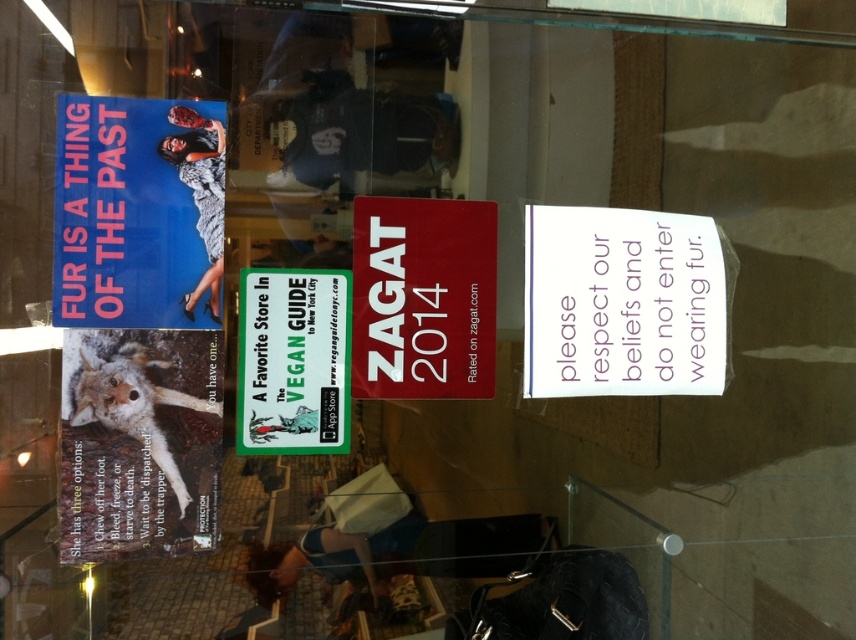
Question: Where is white paper sign at center located in relation to white fur poster at left in the image?

Choices:
 (A) below
 (B) above

Answer: (B)

Question: Can you confirm if blue paper poster at upper left is positioned to the left of matte red sign at center?

Choices:
 (A) no
 (B) yes

Answer: (B)

Question: Is blue paper poster at upper left in front of green paper sign at center?

Choices:
 (A) no
 (B) yes

Answer: (B)

Question: Among these points, which one is nearest to the camera?

Choices:
 (A) (467, 230)
 (B) (277, 280)
 (C) (129, 170)

Answer: (C)

Question: Estimate the real-world distances between objects in this image. Which object is closer to the green paper sign at center?

Choices:
 (A) white fur poster at left
 (B) white paper sign at center
 (C) matte red sign at center
 (D) blue paper poster at upper left

Answer: (C)

Question: Which object is closer to the camera taking this photo?

Choices:
 (A) matte red sign at center
 (B) green paper sign at center

Answer: (B)